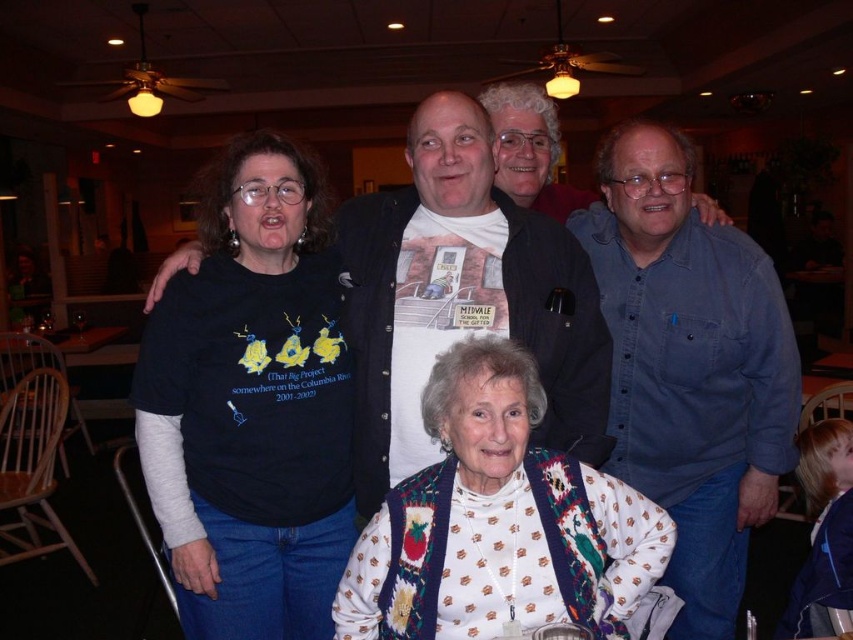
Question: Is black t-shirt at left wider than blue denim shirt at upper right?

Choices:
 (A) yes
 (B) no

Answer: (B)

Question: Does black t-shirt at left appear on the right side of blue denim shirt at upper right?

Choices:
 (A) no
 (B) yes

Answer: (A)

Question: Where is black t-shirt at left located in relation to blue denim shirt at upper right in the image?

Choices:
 (A) right
 (B) left

Answer: (B)

Question: Based on their relative distances, which object is farther from the white knitted sweater at center?

Choices:
 (A) blue denim shirt at upper right
 (B) white t-shirt at center

Answer: (A)

Question: Among these objects, which one is farthest from the camera?

Choices:
 (A) blue denim shirt at upper right
 (B) white t-shirt at center

Answer: (A)

Question: Which point appears closest to the camera in this image?

Choices:
 (A) (363, 333)
 (B) (689, 262)
 (C) (471, 355)
 (D) (199, 342)

Answer: (C)